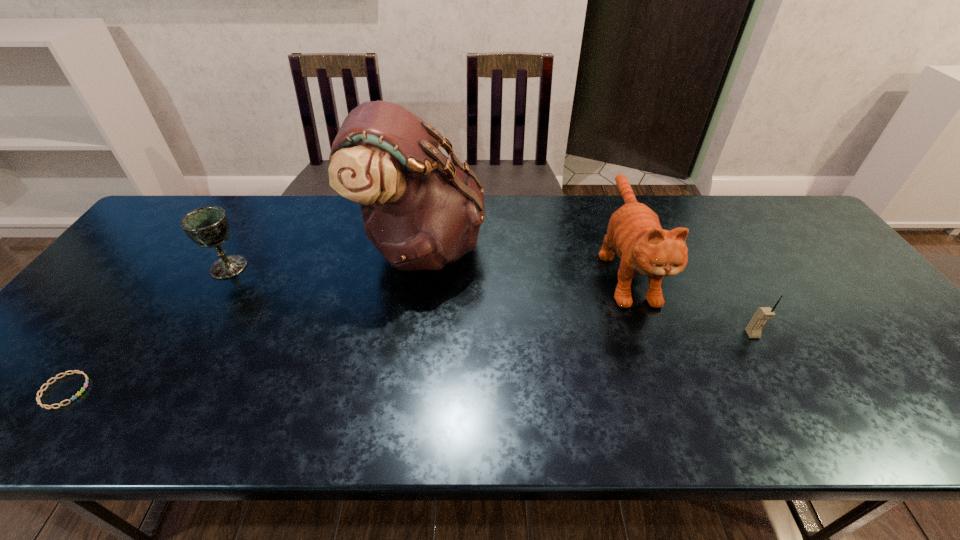
You are a GUI agent. You are given a task and a screenshot of the screen. Output one action in this format:
    pyautogui.click(x=<x>, y=<y>)
    Task: Click on the free space at the far edge of the desktop
    
    Given the screenshot: What is the action you would take?
    pyautogui.click(x=641, y=195)

The image size is (960, 540). Find the location of `vacant space at the near edge`. vacant space at the near edge is located at coordinates (196, 406).

In the image, there is a desktop. Find the location of `blank space at the left edge`. blank space at the left edge is located at coordinates (109, 303).

The image size is (960, 540). In the image, there is a desktop. Find the location of `free region at the right edge`. free region at the right edge is located at coordinates (944, 395).

Where is `free region at the far right corner of the desktop`? The width and height of the screenshot is (960, 540). free region at the far right corner of the desktop is located at coordinates (802, 235).

Locate an element on the screen. unoccupied position between the fourth tallest object and the fourth object from right to left is located at coordinates (491, 301).

This screenshot has width=960, height=540. What are the coordinates of `vacant region between the rightmost object and the fourth object from left to right` in the screenshot? It's located at (689, 301).

The height and width of the screenshot is (540, 960). Identify the location of free space between the satchel and the rightmost object. (588, 290).

At what (x,y) coordinates should I click in order to perform the action: click on free space between the bracelet and the cat. Please return your answer as a coordinate pair (x, y). The height and width of the screenshot is (540, 960). Looking at the image, I should click on (346, 329).

You are a GUI agent. You are given a task and a screenshot of the screen. Output one action in this format:
    pyautogui.click(x=<x>, y=<y>)
    Task: Click on the free spot between the third shortest object and the fourth farthest object
    This screenshot has width=960, height=540.
    Given the screenshot: What is the action you would take?
    pyautogui.click(x=491, y=301)